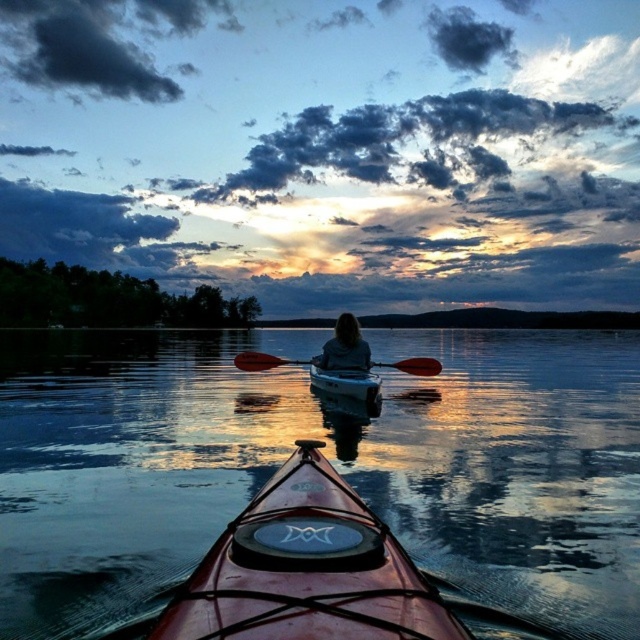
Question: Can you confirm if glossy water at center is bigger than dark brown hair at center?

Choices:
 (A) no
 (B) yes

Answer: (B)

Question: Among these objects, which one is nearest to the camera?

Choices:
 (A) orange paddle at center
 (B) matte white canoe at center

Answer: (B)

Question: Which object is the farthest from the shiny red canoe at center?

Choices:
 (A) dark brown hair at center
 (B) orange paddle at center

Answer: (B)

Question: Does shiny red canoe at center have a greater width compared to orange paddle at center?

Choices:
 (A) no
 (B) yes

Answer: (A)

Question: Is glossy water at center to the left of orange paddle at center from the viewer's perspective?

Choices:
 (A) yes
 (B) no

Answer: (A)

Question: Estimate the real-world distances between objects in this image. Which object is farther from the matte white canoe at center?

Choices:
 (A) orange paddle at center
 (B) dark brown hair at center
 (C) shiny red canoe at center
 (D) glossy water at center

Answer: (C)